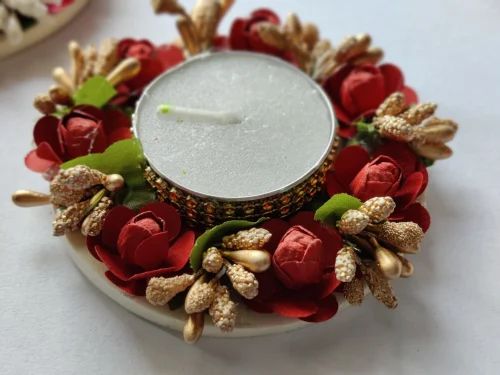
The width and height of the screenshot is (500, 375). Identify the location of fake golden flowers. (222, 274), (365, 247), (403, 134), (330, 59), (202, 24), (97, 68), (80, 192).